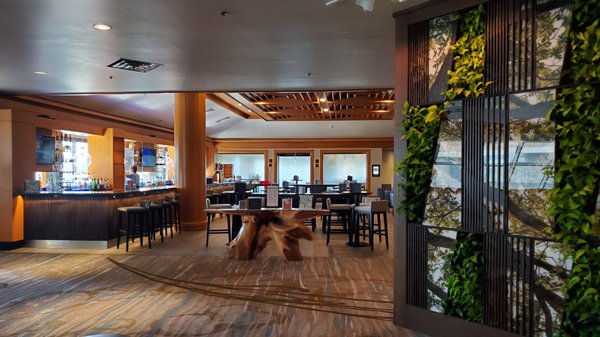
Identify the location of walls. (25, 168), (316, 154), (378, 156).